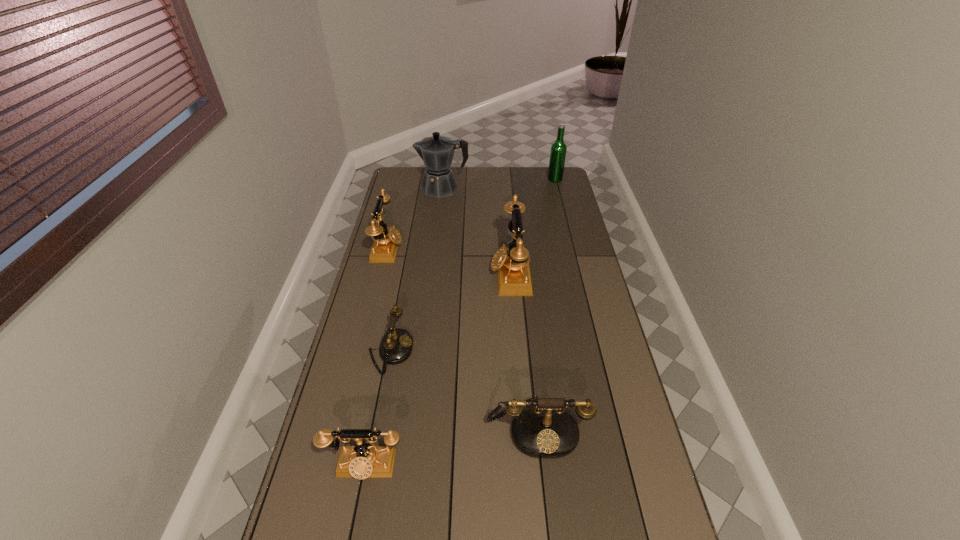
I want to click on beer bottle, so click(558, 149).

Locate an element on the screen. The width and height of the screenshot is (960, 540). the rightmost object is located at coordinates click(558, 149).

I want to click on coffeepot, so click(437, 152).

This screenshot has height=540, width=960. I want to click on the tallest telephone, so click(x=512, y=264).

Where is `the biggest beige telephone`? The height and width of the screenshot is (540, 960). the biggest beige telephone is located at coordinates (512, 264).

You are a GUI agent. You are given a task and a screenshot of the screen. Output one action in this format:
    pyautogui.click(x=<x>, y=<y>)
    Task: Click on the fourth shortest object
    
    Given the screenshot: What is the action you would take?
    pyautogui.click(x=386, y=241)

You are a GUI agent. You are given a task and a screenshot of the screen. Output one action in this format:
    pyautogui.click(x=<x>, y=<y>)
    Task: Click on the fourth shortest telephone
    The image size is (960, 540).
    Given the screenshot: What is the action you would take?
    pyautogui.click(x=386, y=241)

I want to click on the nearer black telephone, so click(544, 431).

This screenshot has height=540, width=960. Identify the location of the right black telephone. (544, 431).

Where is `the smallest beige telephone`? This screenshot has width=960, height=540. the smallest beige telephone is located at coordinates (361, 461).